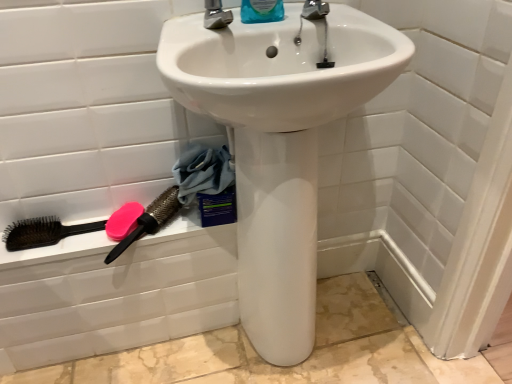
You are a GUI agent. You are given a task and a screenshot of the screen. Output one action in this format:
    pyautogui.click(x=<x>, y=<y>)
    Task: Click on the vacant area situated below white glossy sink at center (from a real-world perspective)
    
    Given the screenshot: What is the action you would take?
    pyautogui.click(x=296, y=355)